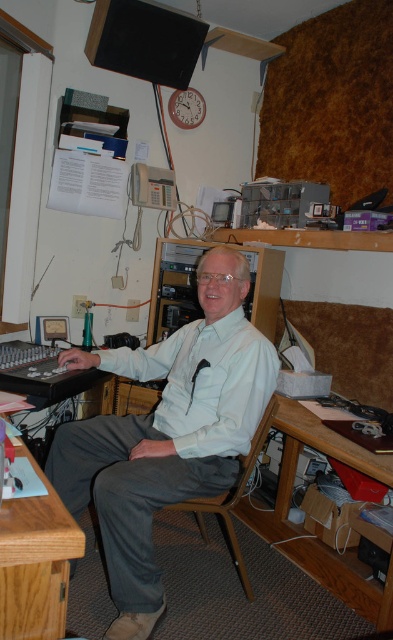
Question: Which point is closer to the camera?

Choices:
 (A) brown wood table at lower left
 (B) white matte shirt at center
 (C) wooden at lower right

Answer: (A)

Question: Does white matte shirt at center have a greater width compared to wooden at lower right?

Choices:
 (A) no
 (B) yes

Answer: (B)

Question: Which object is positioned farthest from the wooden chair at center?

Choices:
 (A) brown wood table at lower left
 (B) white matte shirt at center

Answer: (A)

Question: From the image, what is the correct spatial relationship of white matte shirt at center in relation to brown wood table at lower left?

Choices:
 (A) left
 (B) right

Answer: (B)

Question: Does brown wood table at lower left have a smaller size compared to wooden at lower right?

Choices:
 (A) yes
 (B) no

Answer: (A)

Question: Which object is farther from the camera taking this photo?

Choices:
 (A) wooden at lower right
 (B) brown wood table at lower left
 (C) white matte shirt at center

Answer: (A)